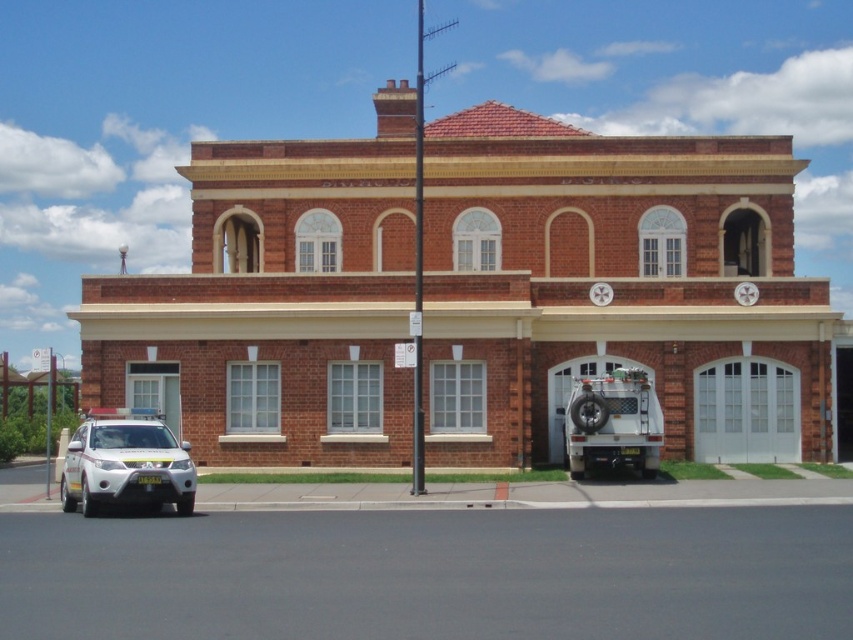
Question: Is brown brick fire station at center smaller than white matte suv at lower left?

Choices:
 (A) yes
 (B) no

Answer: (B)

Question: Which point is closer to the camera?

Choices:
 (A) (640, 400)
 (B) (717, 388)

Answer: (A)

Question: Which of the following is the closest to the observer?

Choices:
 (A) white rubber fire truck at lower right
 (B) white matte suv at lower left

Answer: (B)

Question: Can you confirm if brown brick fire station at center is smaller than white matte suv at lower left?

Choices:
 (A) no
 (B) yes

Answer: (A)

Question: Is brown brick fire station at center to the left of white matte suv at lower left from the viewer's perspective?

Choices:
 (A) no
 (B) yes

Answer: (A)

Question: Considering the real-world distances, which object is closest to the white rubber fire truck at lower right?

Choices:
 (A) brown brick fire station at center
 (B) white matte suv at lower left

Answer: (A)